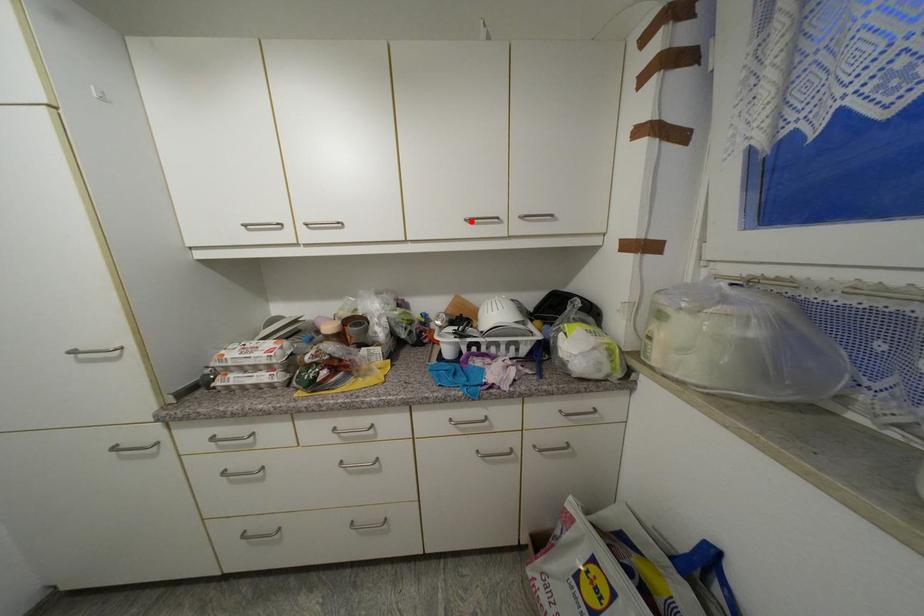
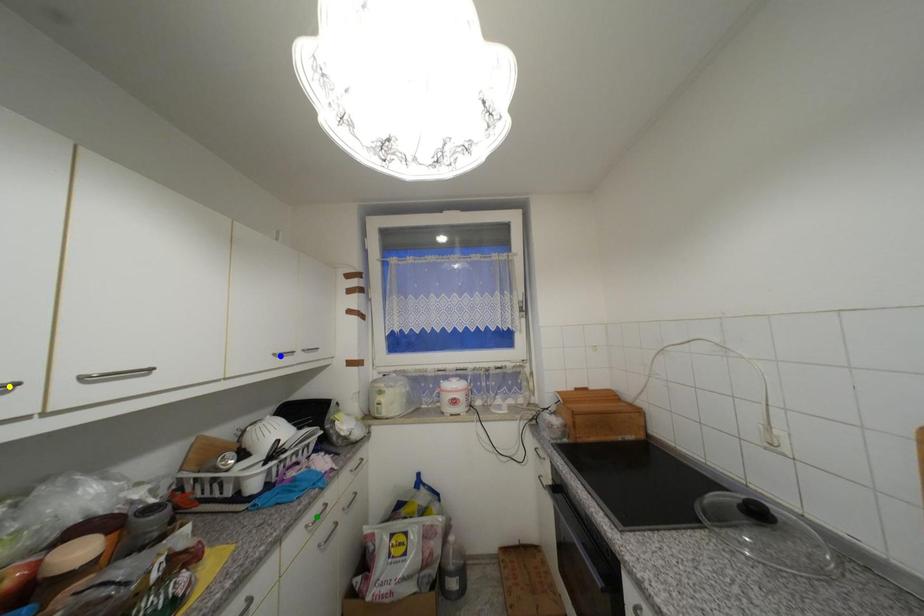
Question: I am providing you with two images of the same scene from different viewpoints. A red point is marked on the first image. You are given multiple points on the second image. Which spot in image 2 lines up with the point in image 1?

Choices:
 (A) yellow point
 (B) blue point
 (C) green point

Answer: (B)